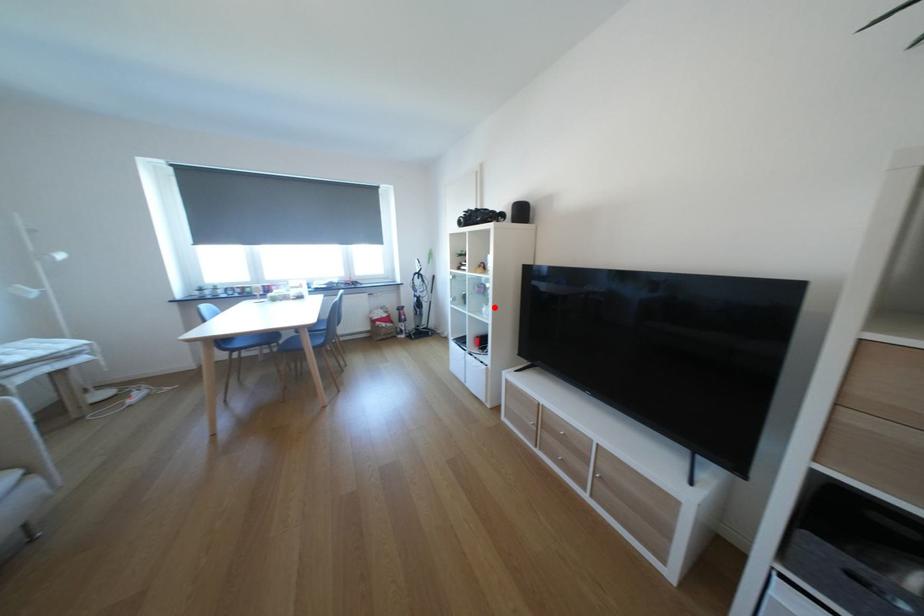
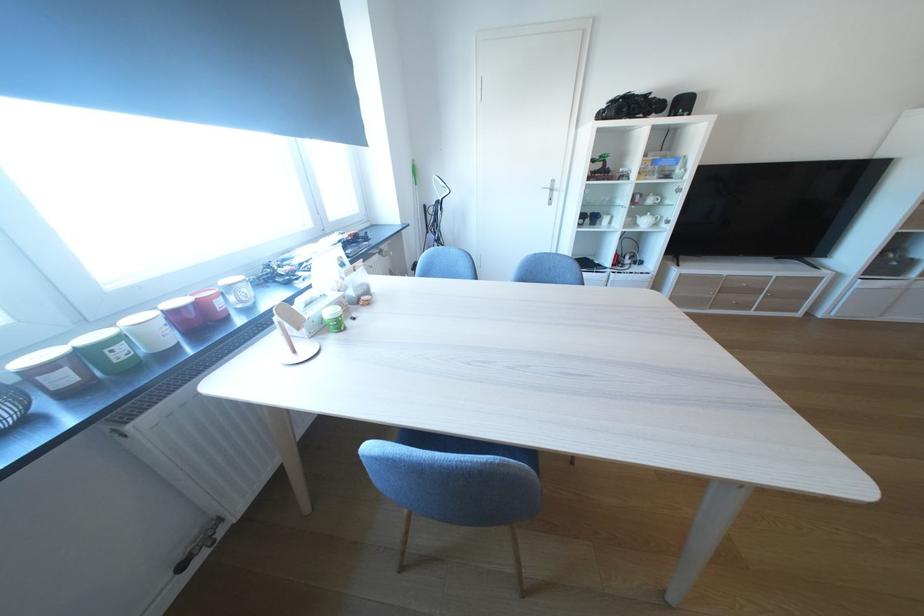
Locate, in the second image, the point that corresponds to the highlighted location in the first image.

(648, 220)